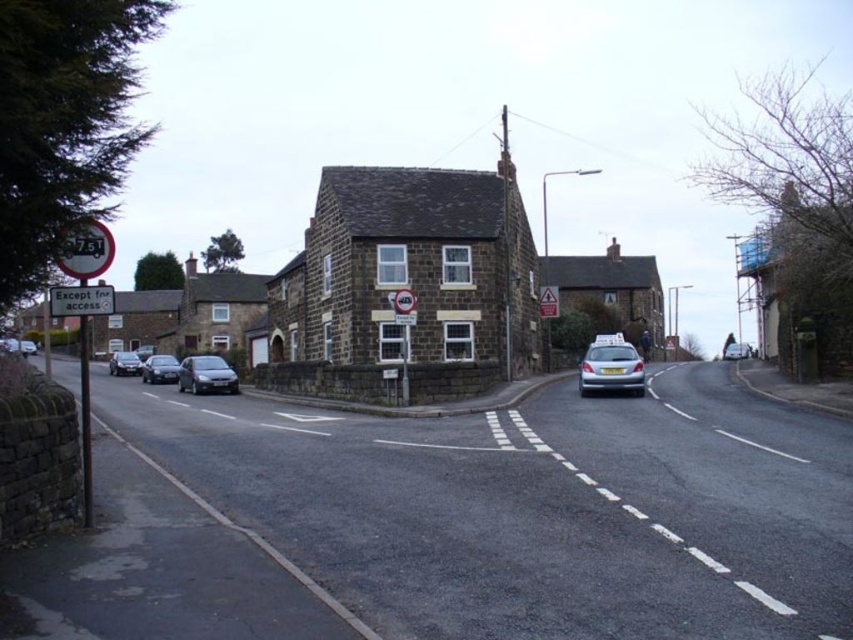
Based on the photo, you are driving on a rural road and see a two story stone building at the corner. There is a point marked at coordinates (548, 301). What object is located at that point?

The metallic triangular warning sign at center is located at the point marked at coordinates (548, 301).

You are a driver approaching the intersection and see the point at coordinates (85, 250) on the metallic circular sign at left. What does this point indicate?

The point at coordinates (85, 250) is located on the metallic circular sign at left, which indicates the speed limit of 20 miles per hour. Therefore, the point marks the location of the speed limit sign.